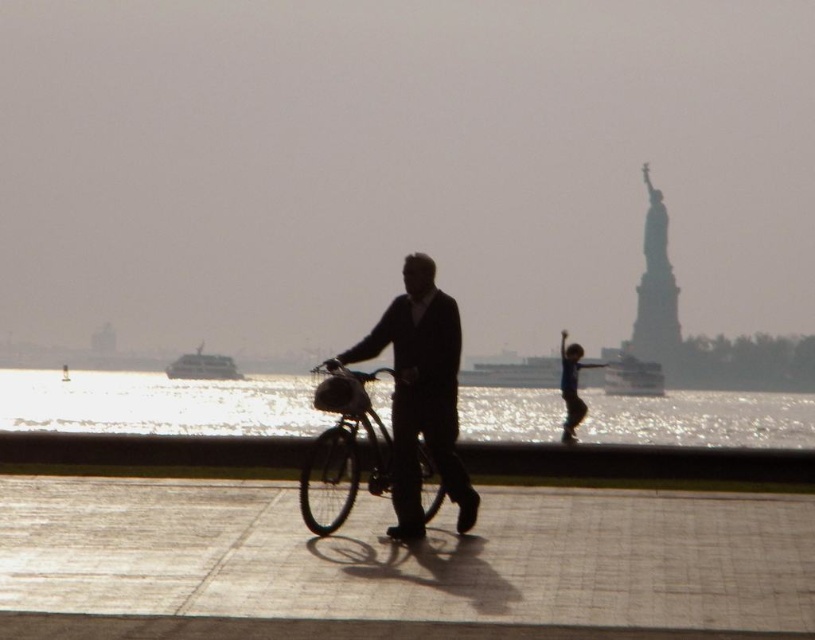
Is dark suit at center wider than blue fabric shirt at center?

No, dark suit at center is not wider than blue fabric shirt at center.

Who is shorter, dark suit at center or blue fabric shirt at center?

dark suit at center is shorter.

What do you see at coordinates (421, 394) in the screenshot? I see `dark suit at center` at bounding box center [421, 394].

The width and height of the screenshot is (815, 640). Identify the location of dark suit at center. (421, 394).

Image resolution: width=815 pixels, height=640 pixels. What do you see at coordinates (399, 564) in the screenshot?
I see `smooth concrete sidewalk at center` at bounding box center [399, 564].

Is point (135, 508) closer to viewer compared to point (355, 355)?

No, it is not.

Where is `smooth concrete sidewalk at center`? smooth concrete sidewalk at center is located at coordinates (399, 564).

Is point (351, 380) in front of point (562, 424)?

Yes, it is in front of point (562, 424).

Between metallic silver bicycle at center and blue fabric shirt at center, which one appears on the right side from the viewer's perspective?

blue fabric shirt at center is more to the right.

Is point (306, 492) positioned after point (562, 342)?

No, (306, 492) is in front of (562, 342).

Locate an element on the screen. metallic silver bicycle at center is located at coordinates (346, 444).